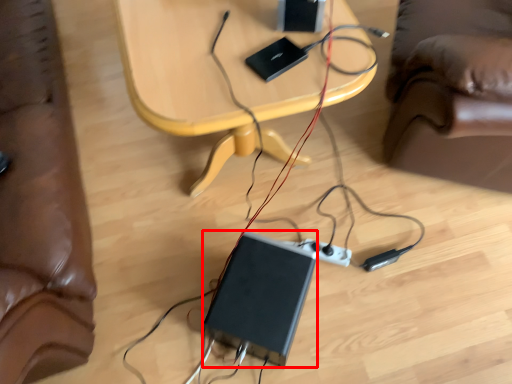
Question: From the image's perspective, what is the correct spatial relationship of computer (annotated by the red box) in relation to table?

Choices:
 (A) above
 (B) below

Answer: (B)